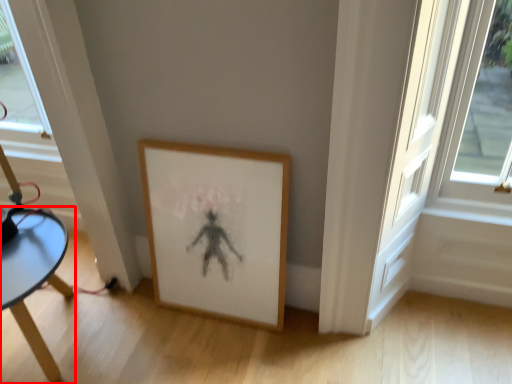
Question: Where is table (annotated by the red box) located in relation to picture frame in the image?

Choices:
 (A) right
 (B) left

Answer: (B)